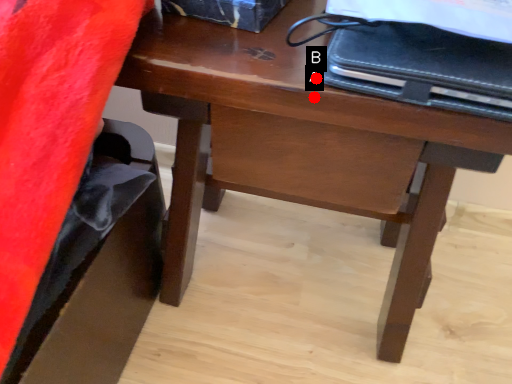
Question: Two points are circled on the image, labeled by A and B beside each circle. Which point appears closest to the camera in this image?

Choices:
 (A) A is closer
 (B) B is closer

Answer: (A)